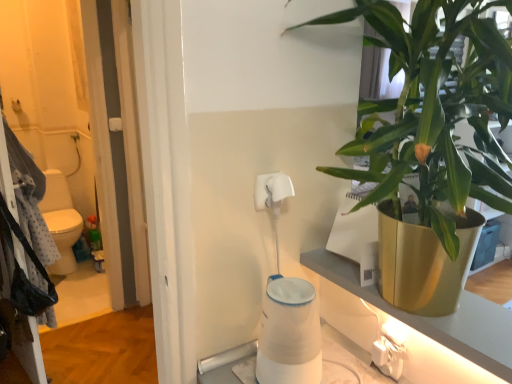
Question: Does white matte toilet paper at upper center, which is the second toilet paper in bottom-to-top order, have a lesser width compared to spotted fabric laundry at left?

Choices:
 (A) yes
 (B) no

Answer: (A)

Question: Is white matte toilet paper at upper center, which is the second toilet paper in bottom-to-top order, bigger than spotted fabric laundry at left?

Choices:
 (A) no
 (B) yes

Answer: (A)

Question: Considering the relative positions of white matte toilet paper at upper center, which ranks as the 1th toilet paper in top-to-bottom order, and spotted fabric laundry at left in the image provided, is white matte toilet paper at upper center, which ranks as the 1th toilet paper in top-to-bottom order, to the left of spotted fabric laundry at left from the viewer's perspective?

Choices:
 (A) no
 (B) yes

Answer: (A)

Question: Is there a large distance between white matte toilet paper at upper center, which is the second toilet paper in bottom-to-top order, and spotted fabric laundry at left?

Choices:
 (A) no
 (B) yes

Answer: (B)

Question: Does white matte toilet paper at upper center, which ranks as the 1th toilet paper in top-to-bottom order, lie behind spotted fabric laundry at left?

Choices:
 (A) no
 (B) yes

Answer: (A)

Question: Choose the correct answer: Is green leafy plant at upper right inside white matte toilet paper at center, arranged as the 1th toilet paper when ordered from the bottom, or outside it?

Choices:
 (A) outside
 (B) inside

Answer: (A)

Question: Considering the relative positions of green leafy plant at upper right and white matte toilet paper at center, which ranks as the second toilet paper in top-to-bottom order, in the image provided, is green leafy plant at upper right to the left or to the right of white matte toilet paper at center, which ranks as the second toilet paper in top-to-bottom order,?

Choices:
 (A) right
 (B) left

Answer: (A)

Question: Considering the positions of green leafy plant at upper right and white matte toilet paper at center, which ranks as the second toilet paper in top-to-bottom order, in the image, is green leafy plant at upper right wider or thinner than white matte toilet paper at center, which ranks as the second toilet paper in top-to-bottom order,?

Choices:
 (A) wide
 (B) thin

Answer: (A)

Question: From the image's perspective, is green leafy plant at upper right positioned above or below white matte toilet paper at center, which ranks as the second toilet paper in top-to-bottom order?

Choices:
 (A) above
 (B) below

Answer: (A)

Question: In terms of size, does spotted fabric laundry at left appear bigger or smaller than white matte toilet paper at upper center, which ranks as the 1th toilet paper in top-to-bottom order?

Choices:
 (A) small
 (B) big

Answer: (B)

Question: Is point (16, 158) closer or farther from the camera than point (275, 173)?

Choices:
 (A) closer
 (B) farther

Answer: (B)

Question: In terms of height, does spotted fabric laundry at left look taller or shorter compared to white matte toilet paper at upper center, which ranks as the 1th toilet paper in top-to-bottom order?

Choices:
 (A) short
 (B) tall

Answer: (B)

Question: Is spotted fabric laundry at left to the left or to the right of white matte toilet paper at upper center, which ranks as the 1th toilet paper in top-to-bottom order, in the image?

Choices:
 (A) left
 (B) right

Answer: (A)

Question: Is white plastic electric outlet at lower right wider or thinner than spotted fabric laundry at left?

Choices:
 (A) wide
 (B) thin

Answer: (B)

Question: Is white plastic electric outlet at lower right inside the boundaries of spotted fabric laundry at left, or outside?

Choices:
 (A) outside
 (B) inside

Answer: (A)